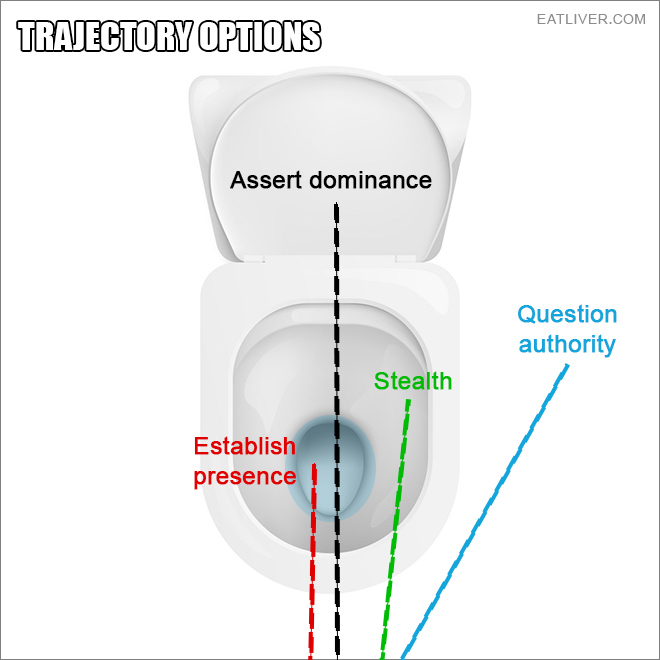
Find the location of a particular element. toilet tank is located at coordinates (x=449, y=92).